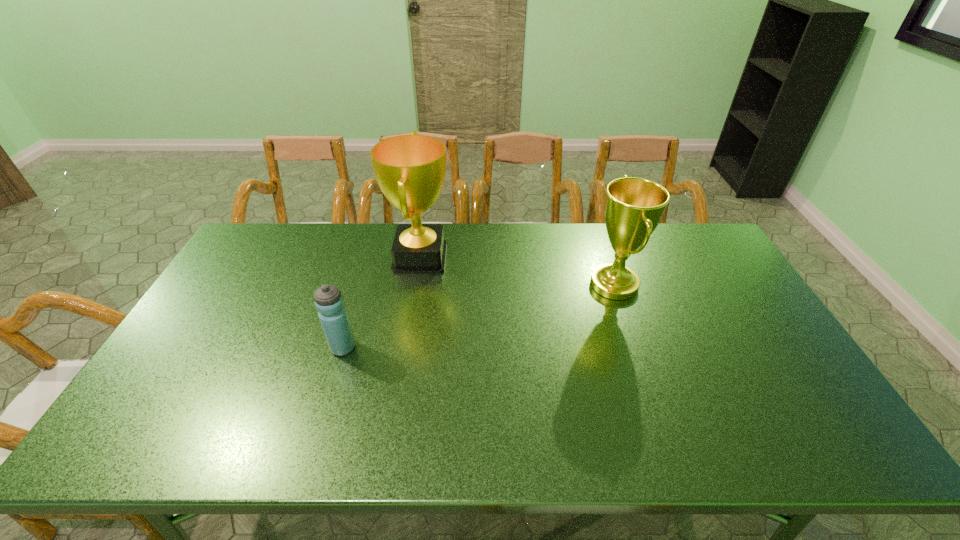
Find the location of a particular element. The image size is (960, 540). the second object from left to right is located at coordinates (410, 170).

Find the location of a particular element. the right award is located at coordinates (634, 206).

In order to click on the shorter award in this screenshot , I will do `click(634, 206)`.

Image resolution: width=960 pixels, height=540 pixels. I want to click on water bottle, so click(x=329, y=302).

Where is `the nearest object`? The image size is (960, 540). the nearest object is located at coordinates (329, 302).

Locate an element on the screen. The image size is (960, 540). free location located on the front-facing side of the second object from right to left is located at coordinates (475, 257).

The width and height of the screenshot is (960, 540). What are the coordinates of `vacant space situated by the handles of the right award` in the screenshot? It's located at (531, 285).

Where is `vacant space situated by the handles of the right award`? The height and width of the screenshot is (540, 960). vacant space situated by the handles of the right award is located at coordinates (543, 285).

The image size is (960, 540). I want to click on vacant region located by the handles of the right award, so click(x=506, y=285).

The image size is (960, 540). I want to click on vacant area located 0.130m on the right of the nearest object, so click(x=403, y=347).